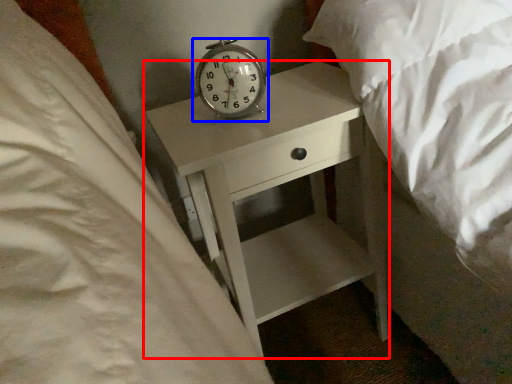
Question: Which of the following is the closest to the observer, nightstand (highlighted by a red box) or alarm clock (highlighted by a blue box)?

Choices:
 (A) nightstand
 (B) alarm clock

Answer: (A)